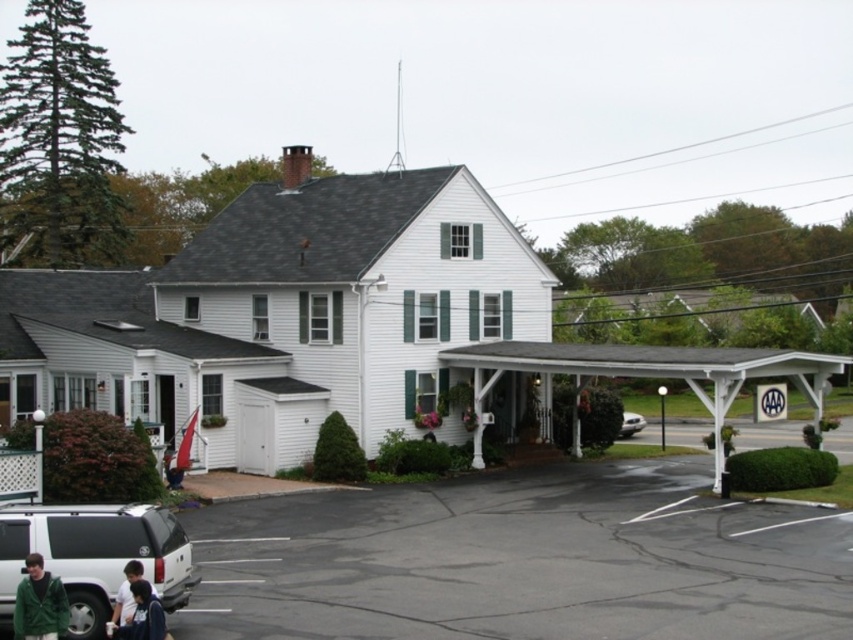
Can you confirm if matte black suv at lower left is positioned to the right of silver metallic sedan at center?

Incorrect, matte black suv at lower left is not on the right side of silver metallic sedan at center.

Does point (28, 516) lie in front of point (622, 428)?

Yes, point (28, 516) is closer to viewer.

Where is `matte black suv at lower left`? matte black suv at lower left is located at coordinates (94, 556).

At what (x,y) coordinates should I click in order to perform the action: click on matte black suv at lower left. Please return your answer as a coordinate pair (x, y). The height and width of the screenshot is (640, 853). Looking at the image, I should click on (94, 556).

Locate an element on the screen. The image size is (853, 640). green fleece jacket at lower left is located at coordinates (39, 604).

Is point (26, 630) positioned after point (115, 604)?

No, (26, 630) is closer to viewer.

Measure the distance between green fleece jacket at lower left and camera.

A distance of 41.14 feet exists between green fleece jacket at lower left and camera.

I want to click on green fleece jacket at lower left, so click(39, 604).

Is matte black suv at lower left smaller than dark blue shirt at lower left?

Actually, matte black suv at lower left might be larger than dark blue shirt at lower left.

Can you confirm if matte black suv at lower left is positioned to the left of dark blue shirt at lower left?

Correct, you'll find matte black suv at lower left to the left of dark blue shirt at lower left.

Who is more distant from viewer, (71, 563) or (115, 604)?

Point (71, 563)

Where is `matte black suv at lower left`? matte black suv at lower left is located at coordinates (94, 556).